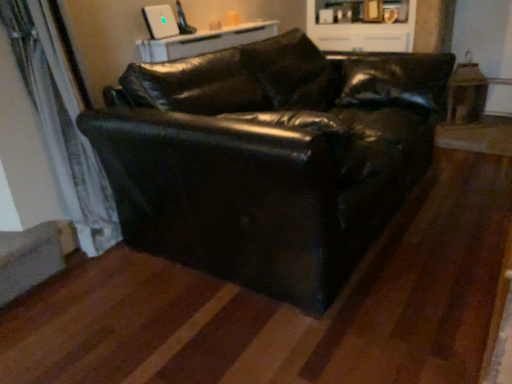
Question: Is white glossy table at upper center smaller than white glossy cabinet at upper center?

Choices:
 (A) no
 (B) yes

Answer: (B)

Question: Is white glossy table at upper center taller than white glossy cabinet at upper center?

Choices:
 (A) yes
 (B) no

Answer: (B)

Question: Considering the relative sizes of white glossy table at upper center and white glossy cabinet at upper center in the image provided, is white glossy table at upper center thinner than white glossy cabinet at upper center?

Choices:
 (A) no
 (B) yes

Answer: (B)

Question: Is white glossy table at upper center in contact with white glossy cabinet at upper center?

Choices:
 (A) no
 (B) yes

Answer: (A)

Question: Is white glossy table at upper center bigger than white glossy cabinet at upper center?

Choices:
 (A) yes
 (B) no

Answer: (B)

Question: Is white glossy table at upper center positioned behind white glossy cabinet at upper center?

Choices:
 (A) yes
 (B) no

Answer: (B)

Question: Is black leather couch at center located outside white sheer curtain at left?

Choices:
 (A) no
 (B) yes

Answer: (B)

Question: Is white sheer curtain at left at the back of black leather couch at center?

Choices:
 (A) yes
 (B) no

Answer: (A)

Question: Can you confirm if black leather couch at center is taller than white sheer curtain at left?

Choices:
 (A) no
 (B) yes

Answer: (A)

Question: From the image's perspective, is black leather couch at center above white sheer curtain at left?

Choices:
 (A) no
 (B) yes

Answer: (B)

Question: Is black leather couch at center aimed at white sheer curtain at left?

Choices:
 (A) yes
 (B) no

Answer: (B)

Question: Is the depth of black leather couch at center less than that of white sheer curtain at left?

Choices:
 (A) no
 (B) yes

Answer: (B)

Question: Can you confirm if white glossy table at upper center is shorter than black leather couch at center?

Choices:
 (A) yes
 (B) no

Answer: (A)